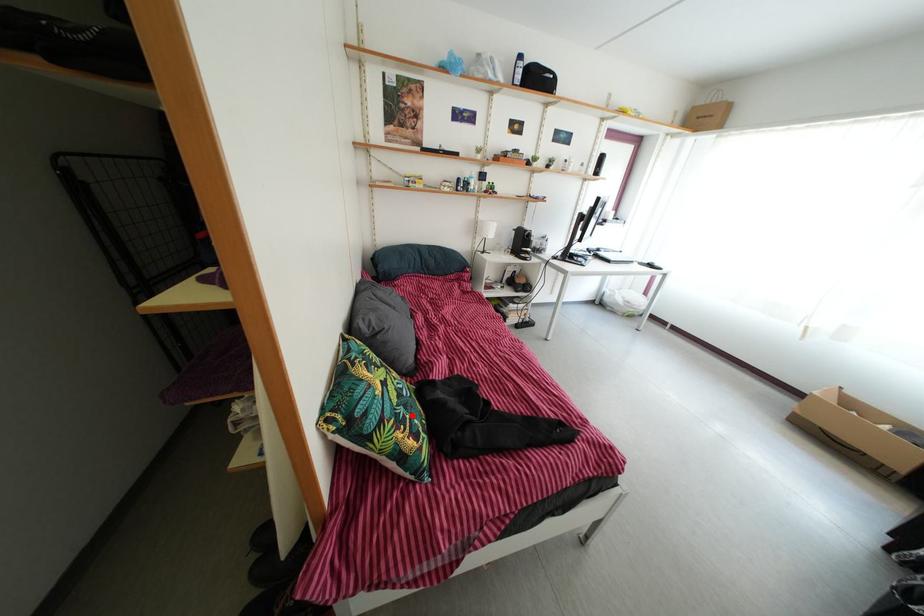
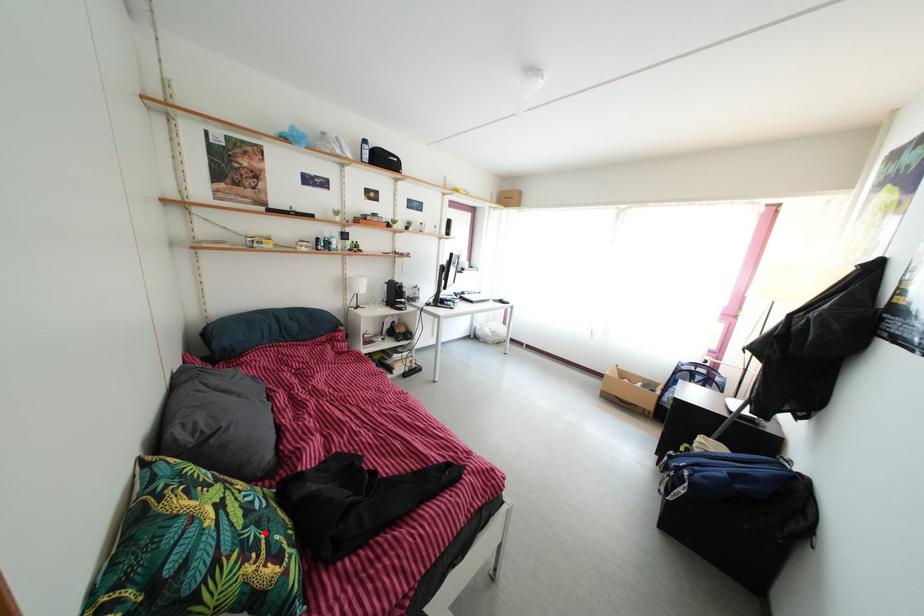
I am providing you with two images of the same scene from different viewpoints. A red point is marked on the first image and another point is marked on the second image. Do the highlighted points in image1 and image2 indicate the same real-world spot?

Yes